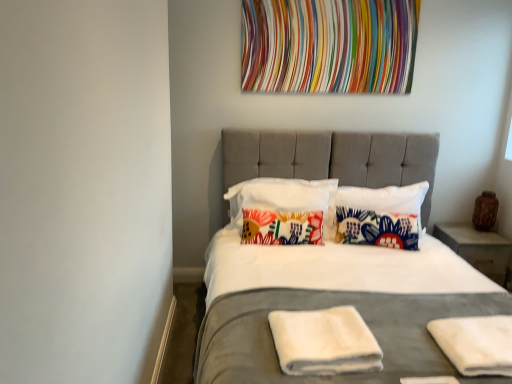
Identify the location of empty space that is ontop of white soft towel at lower right, the 2th material viewed from the left (from a real-world perspective). The height and width of the screenshot is (384, 512). (485, 334).